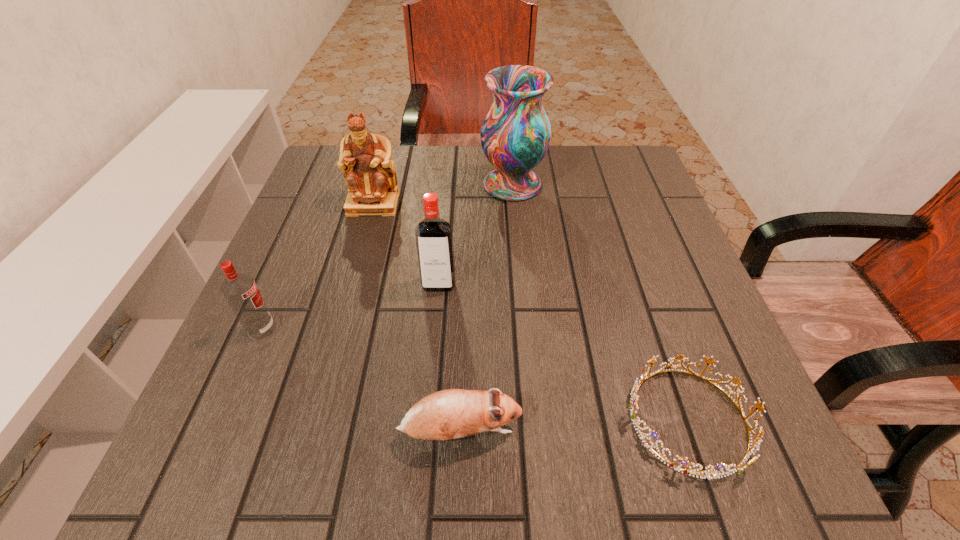
You are a GUI agent. You are given a task and a screenshot of the screen. Output one action in this format:
    pyautogui.click(x=<x>, y=<y>)
    Task: Click on the vase
    The width and height of the screenshot is (960, 540).
    Given the screenshot: What is the action you would take?
    pyautogui.click(x=515, y=134)

Locate an element on the screen. The image size is (960, 540). the fifth object from right to left is located at coordinates (365, 158).

Find the location of a particular element. the right vodka is located at coordinates (434, 240).

You are a GUI agent. You are given a task and a screenshot of the screen. Output one action in this format:
    pyautogui.click(x=<x>, y=<y>)
    Task: Click on the farther vodka
    The width and height of the screenshot is (960, 540).
    Given the screenshot: What is the action you would take?
    pyautogui.click(x=434, y=240)

Identify the location of the shorter vodka. (240, 290).

Where is `the leftmost object`? The width and height of the screenshot is (960, 540). the leftmost object is located at coordinates (240, 290).

Find the location of a particular element. The width and height of the screenshot is (960, 540). hamster is located at coordinates (452, 413).

At what (x,y) coordinates should I click in order to perform the action: click on the shortest object. Please return your answer as a coordinate pair (x, y). The image size is (960, 540). Looking at the image, I should click on (633, 404).

You are a GUI agent. You are given a task and a screenshot of the screen. Output one action in this format:
    pyautogui.click(x=<x>, y=<y>)
    Task: Click on the tiara
    Image resolution: width=960 pixels, height=540 pixels.
    Given the screenshot: What is the action you would take?
    pyautogui.click(x=633, y=404)

Where is `vacant region located on the left of the vase`? The image size is (960, 540). vacant region located on the left of the vase is located at coordinates (441, 185).